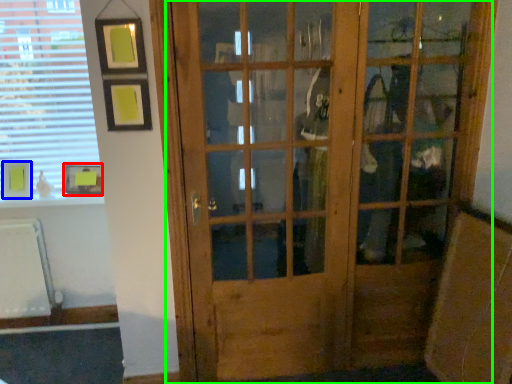
Question: Estimate the real-world distances between objects in this image. Which object is closer to picture frame (highlighted by a red box), picture frame (highlighted by a blue box) or door (highlighted by a green box)?

Choices:
 (A) picture frame
 (B) door

Answer: (A)